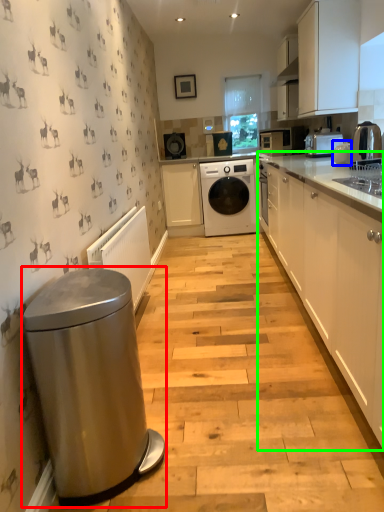
Question: Based on their relative distances, which object is farther from water heater (highlighted by a red box)? Choose from appliance (highlighted by a blue box) and cabinetry (highlighted by a green box).

Choices:
 (A) appliance
 (B) cabinetry

Answer: (A)